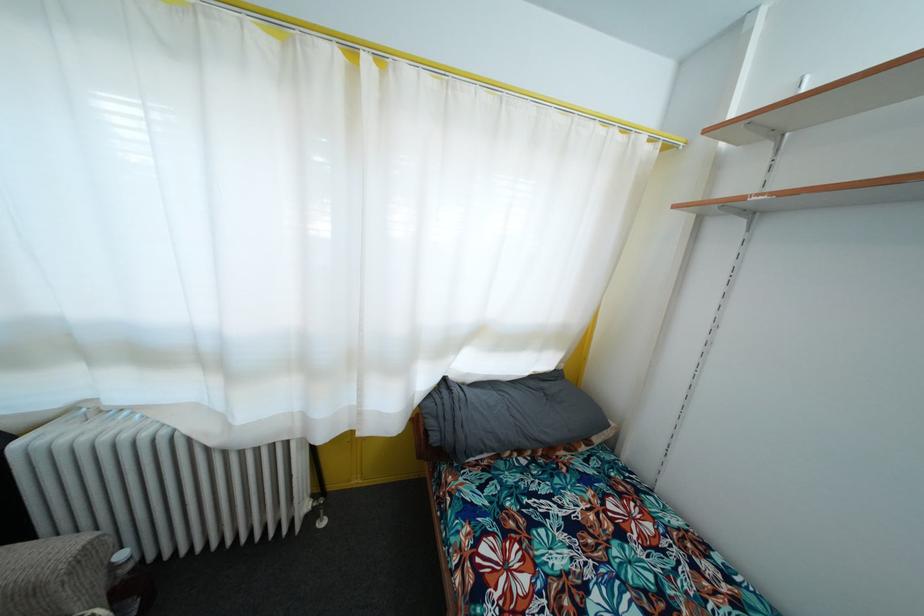
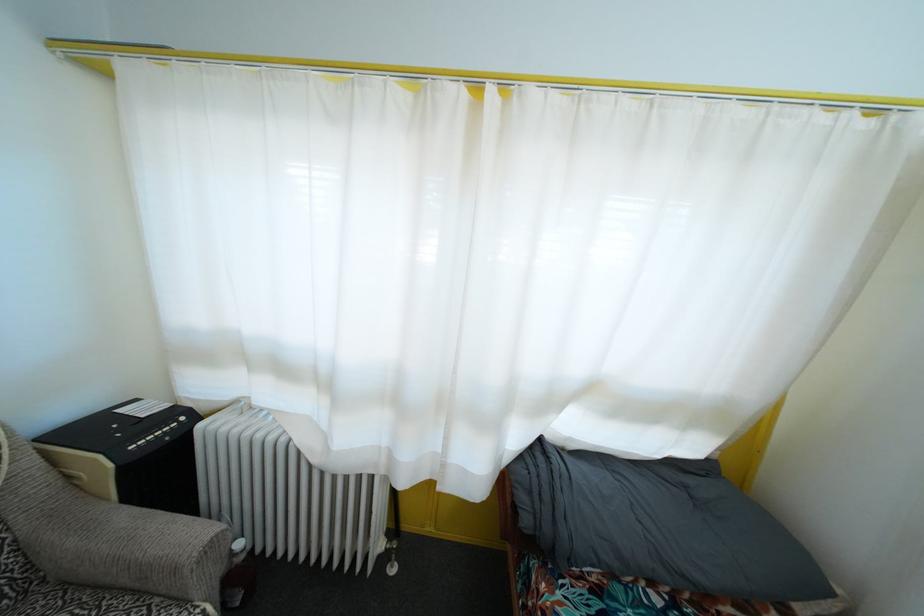
In the second image, find the point that corresponds to (439,445) in the first image.

(529, 528)